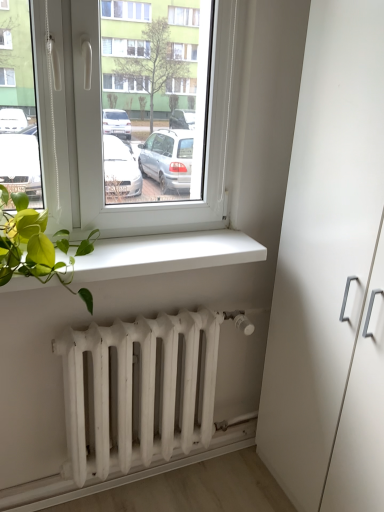
Find the location of a particular element. The width and height of the screenshot is (384, 512). vacant region below white matte radiator at lower center (from a real-world perspective) is located at coordinates (155, 487).